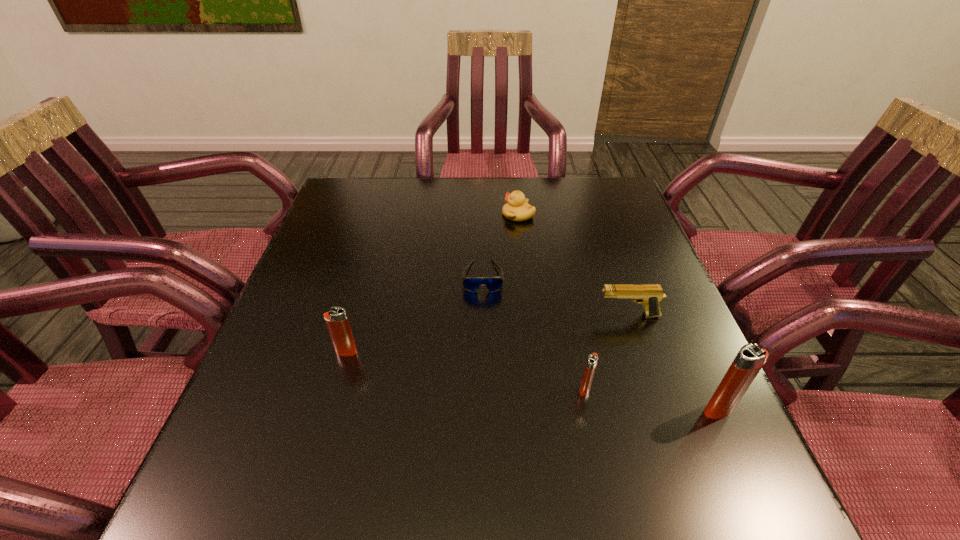
Identify the location of vacant region at the left edge of the desktop. The width and height of the screenshot is (960, 540). (318, 323).

Find the location of a particular element. blank area at the right edge is located at coordinates (658, 339).

The image size is (960, 540). Find the location of `free location at the far left corner of the desktop`. free location at the far left corner of the desktop is located at coordinates (341, 195).

Find the location of a particular element. free space at the far right corner is located at coordinates (595, 213).

I want to click on vacant space that's between the pistol and the leftmost object, so click(x=488, y=334).

You are a GUI agent. You are given a task and a screenshot of the screen. Output one action in this format:
    pyautogui.click(x=<x>, y=<y>)
    Task: Click on the vacant area between the fourth object from left to right and the nearest object
    
    Given the screenshot: What is the action you would take?
    pyautogui.click(x=652, y=399)

Identify the location of free space between the second nearest object and the fourth nearest object. (607, 352).

Find the location of a particular element. unoccupied position between the fourth object from left to right and the pistol is located at coordinates (607, 352).

Locate an element on the screen. Image resolution: width=960 pixels, height=540 pixels. blank region between the third farthest object and the leftmost object is located at coordinates (488, 334).

Image resolution: width=960 pixels, height=540 pixels. In order to click on vacant space that is in between the sunglasses and the farthest object in this screenshot , I will do `click(500, 246)`.